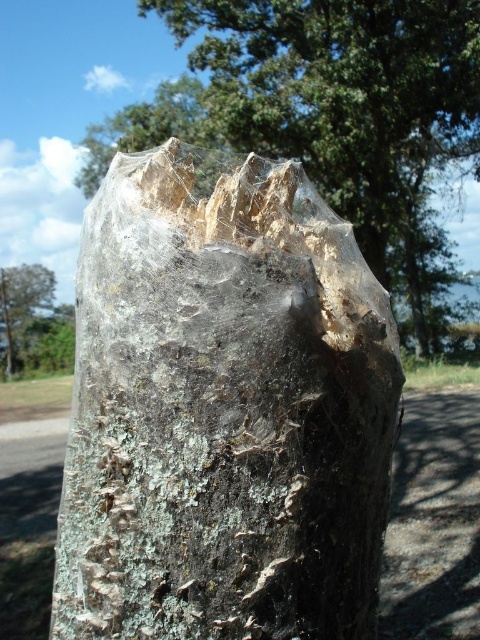
Question: Which of the following is the farthest from the observer?

Choices:
 (A) (178, 538)
 (B) (0, 298)
 (C) (441, 60)

Answer: (B)

Question: Is transparent plastic tree trunk at center closer to the viewer compared to green leafy tree at upper left?

Choices:
 (A) yes
 (B) no

Answer: (A)

Question: Among these objects, which one is nearest to the camera?

Choices:
 (A) transparent plastic tree trunk at center
 (B) translucent plastic bag at center
 (C) green leafy tree at upper left

Answer: (A)

Question: Is transparent plastic tree trunk at center further to camera compared to green leafy tree at upper left?

Choices:
 (A) no
 (B) yes

Answer: (A)

Question: Is translucent plastic bag at center closer to the viewer compared to green leafy tree at upper left?

Choices:
 (A) no
 (B) yes

Answer: (B)

Question: Which of the following is the closest to the observer?

Choices:
 (A) (52, 298)
 (B) (132, 518)
 (C) (325, 125)

Answer: (B)